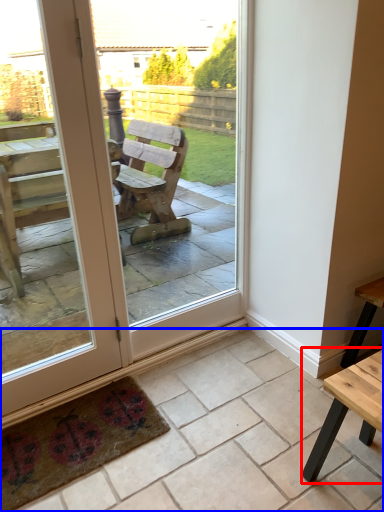
Question: Among these objects, which one is farthest to the camera, table (highlighted by a red box) or tile (highlighted by a blue box)?

Choices:
 (A) table
 (B) tile

Answer: (A)